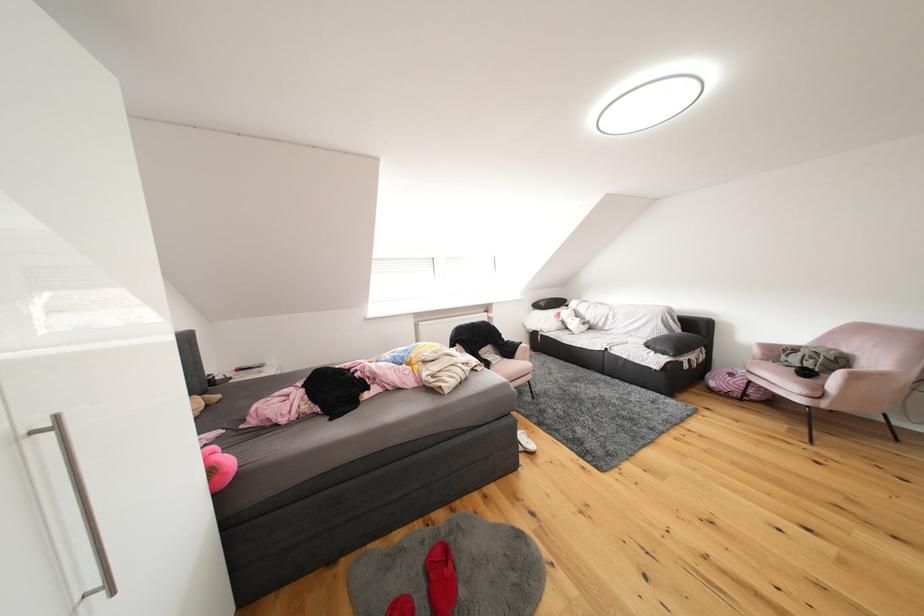
Find where to sit the pink chair sitting surface. Please return your answer as a coordinate pair (x, y).

(785, 377)